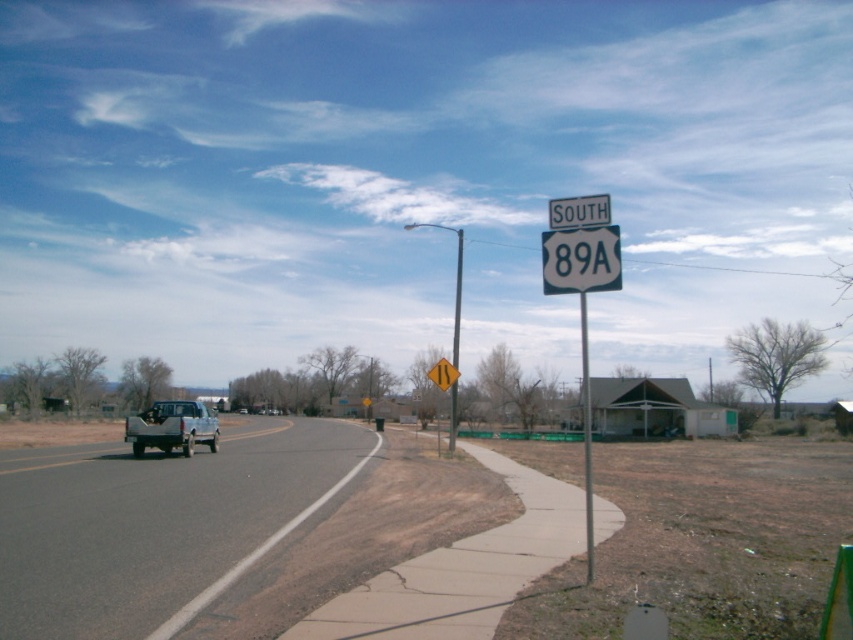
Question: Which of the following is the farthest from the observer?

Choices:
 (A) (459, 372)
 (B) (131, 432)
 (C) (456, 388)
 (D) (587, 557)

Answer: (C)

Question: Can you confirm if white matte truck at left is positioned to the left of metallic pole at upper right?

Choices:
 (A) no
 (B) yes

Answer: (B)

Question: Can you confirm if gray asphalt road at center is positioned above metallic pole at right?

Choices:
 (A) yes
 (B) no

Answer: (B)

Question: Which object is closer to the camera taking this photo?

Choices:
 (A) gray asphalt road at center
 (B) metallic pole at upper right

Answer: (A)

Question: Does metallic pole at upper right appear over metallic pole at right?

Choices:
 (A) no
 (B) yes

Answer: (A)

Question: Which object appears farthest from the camera in this image?

Choices:
 (A) gray asphalt road at center
 (B) metallic pole at right

Answer: (B)